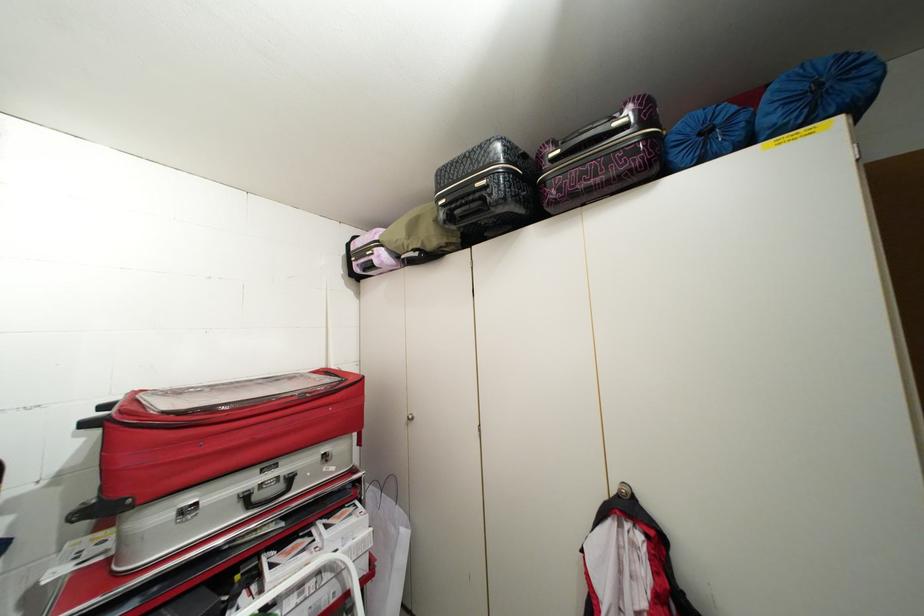
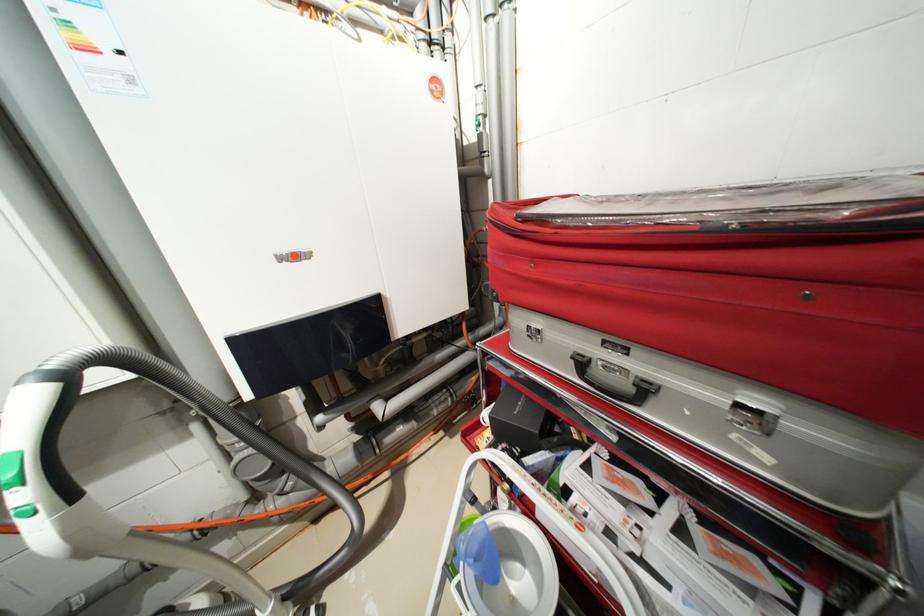
Find the pixel in the second image that matches (253,498) in the first image.

(589, 363)